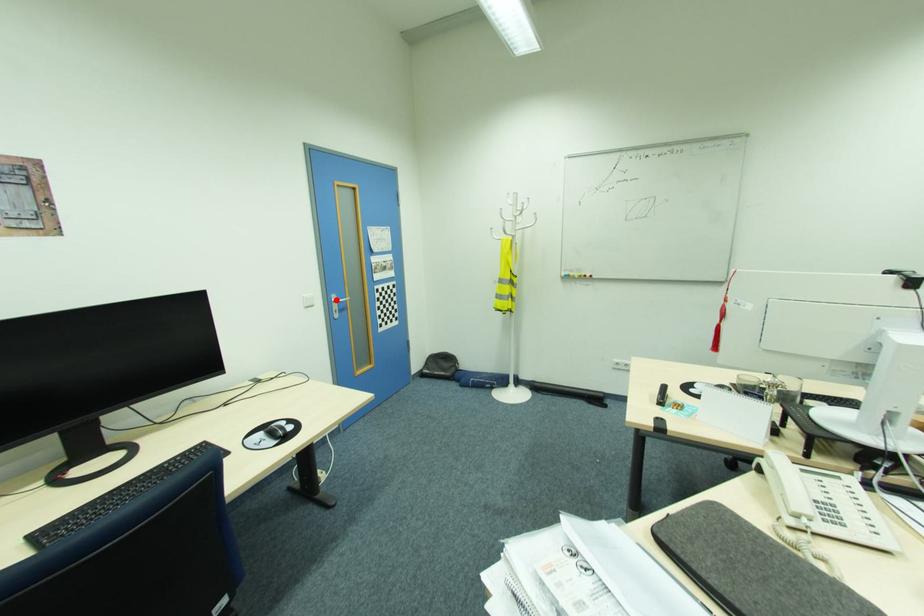
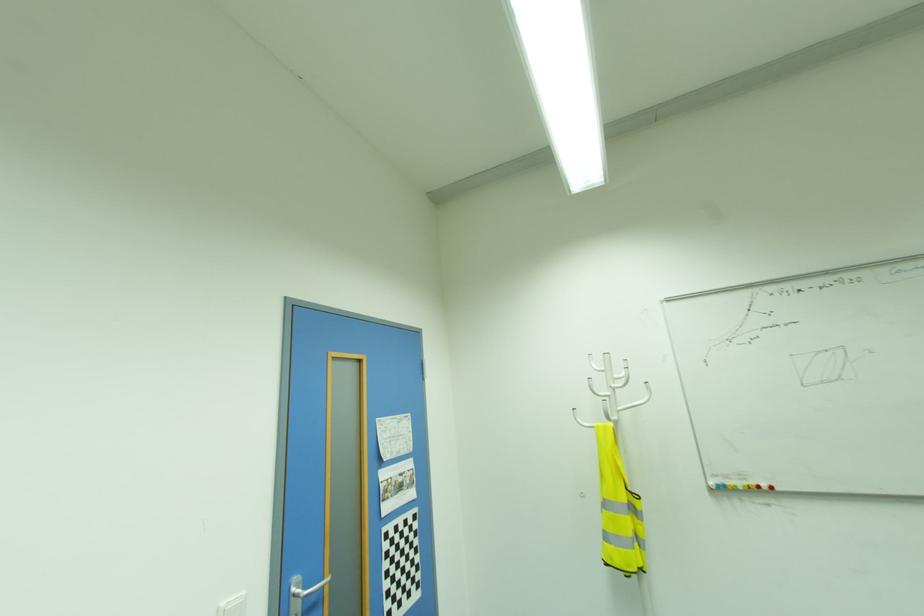
Find the pixel in the second image that matches the highlighted location in the first image.

(296, 590)